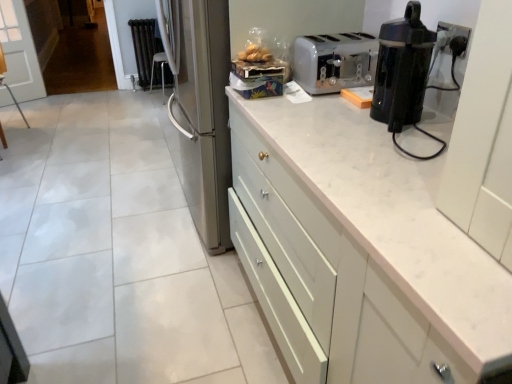
Question: Which is correct: black metallic radiator at upper left is inside white matte cabinet at upper right, or outside of it?

Choices:
 (A) outside
 (B) inside

Answer: (A)

Question: From the image's perspective, is black metallic radiator at upper left positioned above or below white matte cabinet at upper right?

Choices:
 (A) above
 (B) below

Answer: (A)

Question: Which object is positioned closest to the white matte cabinet at upper right?

Choices:
 (A) black plastic electric outlet at upper right
 (B) translucent plastic bag of bread at upper center
 (C) black plastic coffee maker at upper right
 (D) black metallic radiator at upper left
 (E) white plastic toaster at upper right

Answer: (C)

Question: Which of these objects is positioned farthest from the black plastic coffee maker at upper right?

Choices:
 (A) white matte cabinet at upper right
 (B) white plastic toaster at upper right
 (C) black plastic electric outlet at upper right
 (D) black metallic radiator at upper left
 (E) translucent plastic bag of bread at upper center

Answer: (D)